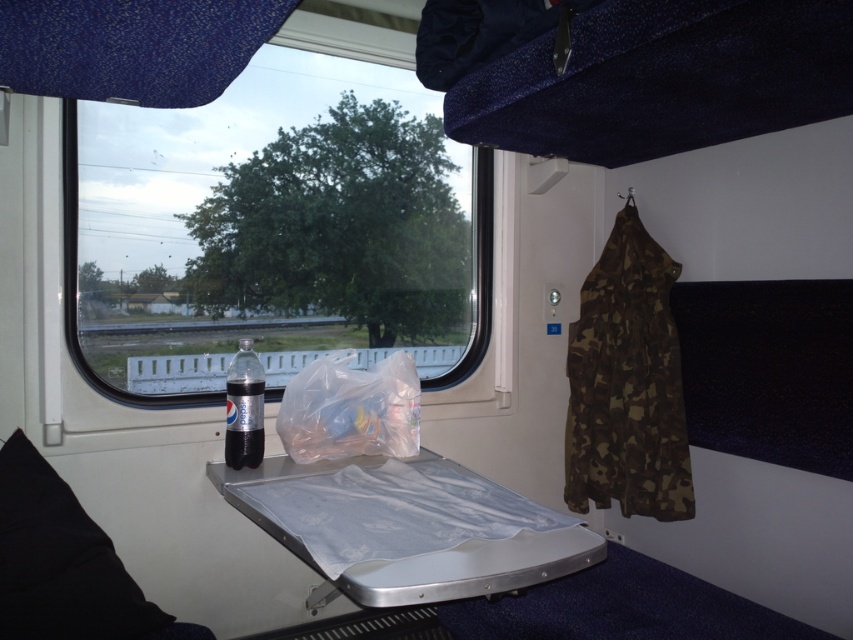
Does transparent plastic window at center have a larger size compared to black matte pepsi bottle at lower left?

No.

Who is more distant from viewer, (x=143, y=189) or (x=242, y=445)?

Positioned behind is point (x=143, y=189).

The height and width of the screenshot is (640, 853). What are the coordinates of `transparent plastic window at center` in the screenshot? It's located at (277, 220).

Does transparent plastic window at center appear on the right side of black fabric pillow at lower left?

Correct, you'll find transparent plastic window at center to the right of black fabric pillow at lower left.

Image resolution: width=853 pixels, height=640 pixels. I want to click on transparent plastic window at center, so click(277, 220).

What do you see at coordinates (277, 220) in the screenshot? I see `transparent plastic window at center` at bounding box center [277, 220].

Locate an element on the screen. Image resolution: width=853 pixels, height=640 pixels. transparent plastic window at center is located at coordinates (277, 220).

Based on the photo, which is more to the left, transparent plastic window at center or translucent plastic bag at center?

transparent plastic window at center

Can you confirm if transparent plastic window at center is shorter than translucent plastic bag at center?

Indeed, transparent plastic window at center has a lesser height compared to translucent plastic bag at center.

Who is more distant from viewer, [129,330] or [314,360]?

Positioned behind is point [129,330].

At what (x,y) coordinates should I click in order to perform the action: click on transparent plastic window at center. Please return your answer as a coordinate pair (x, y). Looking at the image, I should click on (277, 220).